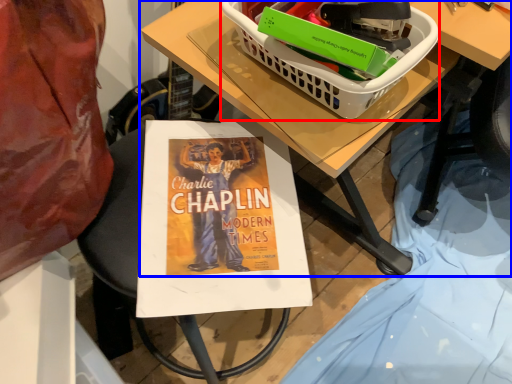
Question: Which object is closer to the camera taking this photo, basket (highlighted by a red box) or table (highlighted by a blue box)?

Choices:
 (A) basket
 (B) table

Answer: (A)